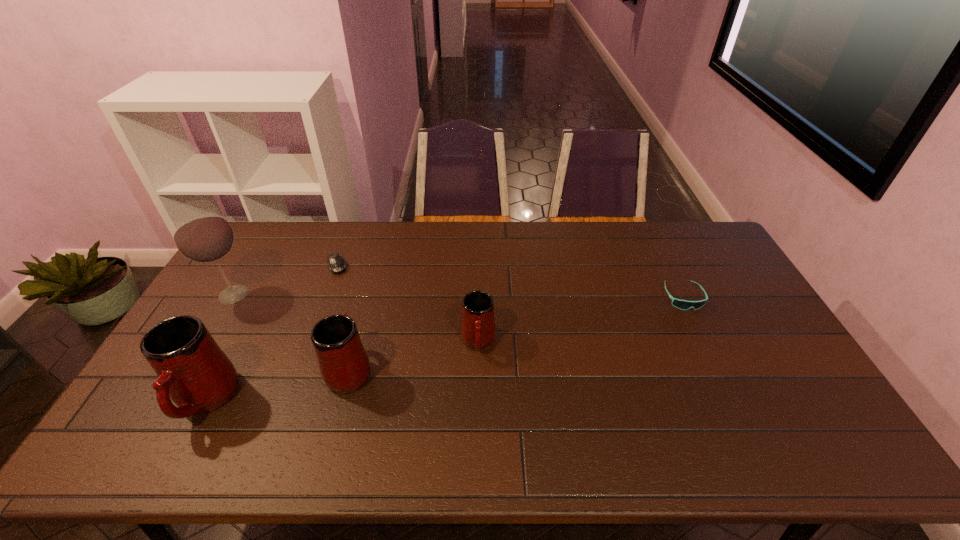
Where is `object present at the right edge`? object present at the right edge is located at coordinates pyautogui.click(x=680, y=304).

You are a GUI agent. You are given a task and a screenshot of the screen. Output one action in this format:
    pyautogui.click(x=<x>, y=<y>)
    Task: Click on the object located in the near left corner section of the desktop
    This screenshot has height=540, width=960.
    Given the screenshot: What is the action you would take?
    pyautogui.click(x=192, y=370)

This screenshot has height=540, width=960. I want to click on free space at the far edge, so click(x=632, y=225).

The width and height of the screenshot is (960, 540). In the image, there is a desktop. What are the coordinates of `vacant space at the near edge` in the screenshot? It's located at (252, 397).

Find the location of a particular element. free space at the left edge of the desktop is located at coordinates (242, 322).

Locate an element on the screen. Image resolution: width=960 pixels, height=540 pixels. vacant position at the right edge of the desktop is located at coordinates (734, 279).

The height and width of the screenshot is (540, 960). In order to click on vacant region at the far left corner in this screenshot , I will do `click(272, 255)`.

Locate an element on the screen. The image size is (960, 540). vacant region at the far right corner is located at coordinates (694, 241).

Locate an element on the screen. free space between the tallest mug and the rightmost object is located at coordinates (444, 348).

I want to click on free area in between the rightmost object and the third object from left to right, so click(x=511, y=282).